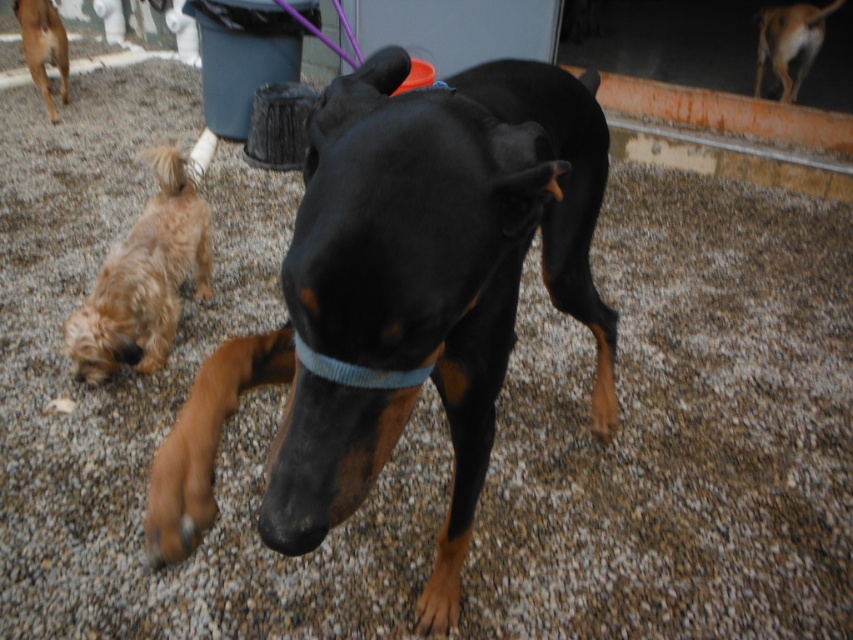
Who is more forward, [169,157] or [62,32]?

Point [169,157]

Measure the distance between fuzzy brown dog at lower left and brown fur dog at upper left.

The distance of fuzzy brown dog at lower left from brown fur dog at upper left is 8.58 feet.

Which is behind, point (109, 339) or point (26, 60)?

The point (26, 60) is behind.

Where is `fuzzy brown dog at lower left`? This screenshot has height=640, width=853. fuzzy brown dog at lower left is located at coordinates (144, 280).

Between fuzzy brown dog at lower left and blue knitted collar at center, which one appears on the left side from the viewer's perspective?

Positioned to the left is fuzzy brown dog at lower left.

Which of these two, fuzzy brown dog at lower left or blue knitted collar at center, stands shorter?

With less height is blue knitted collar at center.

Is point (128, 272) positioned behind point (299, 356)?

Yes, it is.

Where is `fuzzy brown dog at lower left`? fuzzy brown dog at lower left is located at coordinates (144, 280).

Is fuzzy brown dog at lower left further to camera compared to brown fur dog at upper right?

That is False.

Between fuzzy brown dog at lower left and brown fur dog at upper right, which one is positioned lower?

fuzzy brown dog at lower left is lower down.

Is point (97, 292) positioned after point (817, 19)?

No, it is not.

I want to click on fuzzy brown dog at lower left, so click(x=144, y=280).